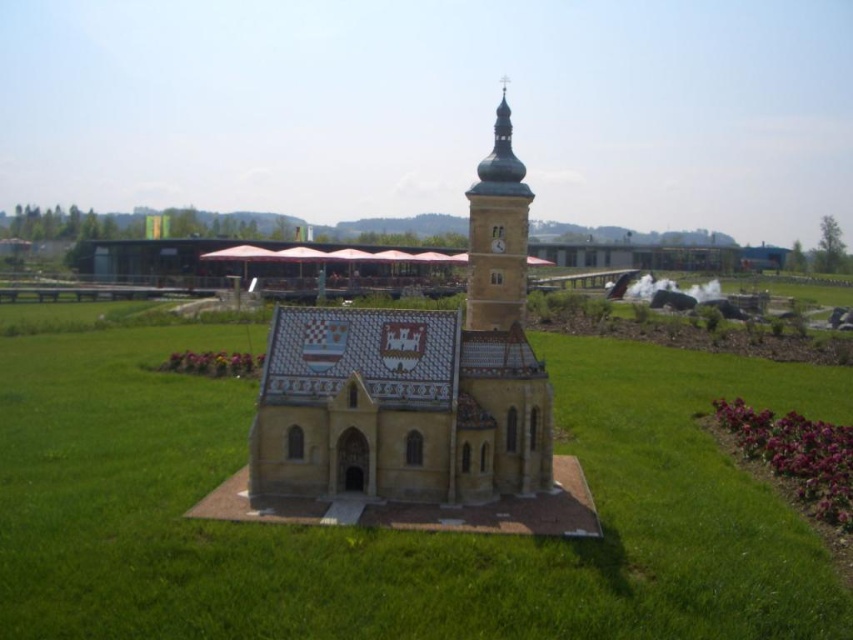
You are a landscape architect designing a garden layout. You have two church models to place in the garden. The checkered tile church at center and the multicolored mosaic church at center. Which one should you choose if you need a wider base to support a large statue?

The checkered tile church at center has a greater width than the multicolored mosaic church at center, so it would provide a wider base to support the large statue.